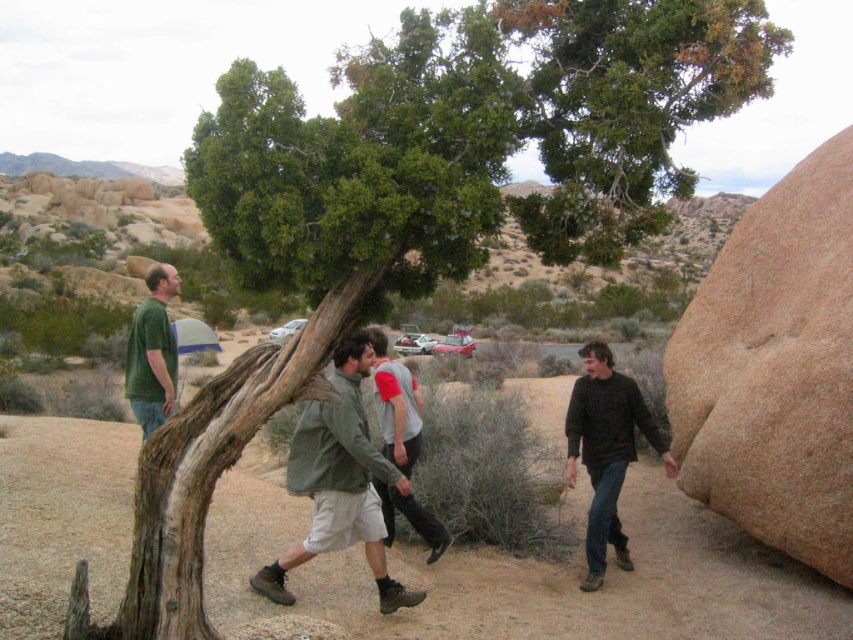
Does green fabric jacket at center lie behind gray-green fabric jacket at center?

No.

Which of these two, green fabric jacket at center or gray-green fabric jacket at center, stands shorter?

Standing shorter between the two is gray-green fabric jacket at center.

What do you see at coordinates (339, 481) in the screenshot?
I see `green fabric jacket at center` at bounding box center [339, 481].

Where is `green fabric jacket at center`? The image size is (853, 640). green fabric jacket at center is located at coordinates (339, 481).

Is brown rough rock at right shorter than green matte shirt at center?

Indeed, brown rough rock at right has a lesser height compared to green matte shirt at center.

Consider the image. Is brown rough rock at right bigger than green matte shirt at center?

Actually, brown rough rock at right might be smaller than green matte shirt at center.

Between point (691, 429) and point (149, 310), which one is positioned behind?

The point (691, 429) is more distant.

Where is `brown rough rock at right`? brown rough rock at right is located at coordinates (775, 369).

Is dark gray sweater at right positioned at the back of green matte shirt at center?

No, dark gray sweater at right is in front of green matte shirt at center.

Which is below, dark gray sweater at right or green matte shirt at center?

dark gray sweater at right is lower down.

Is point (598, 412) closer to viewer compared to point (177, 292)?

Yes, point (598, 412) is closer to viewer.

The width and height of the screenshot is (853, 640). Find the location of `dark gray sweater at right`. dark gray sweater at right is located at coordinates (606, 451).